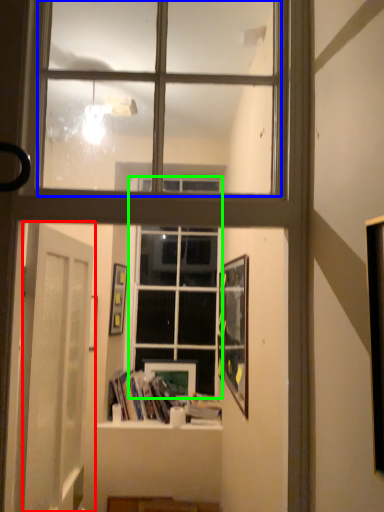
Question: Which object is positioned closest to door (highlighted by a red box)? Select from bay window (highlighted by a blue box) and window (highlighted by a green box).

Choices:
 (A) bay window
 (B) window

Answer: (A)